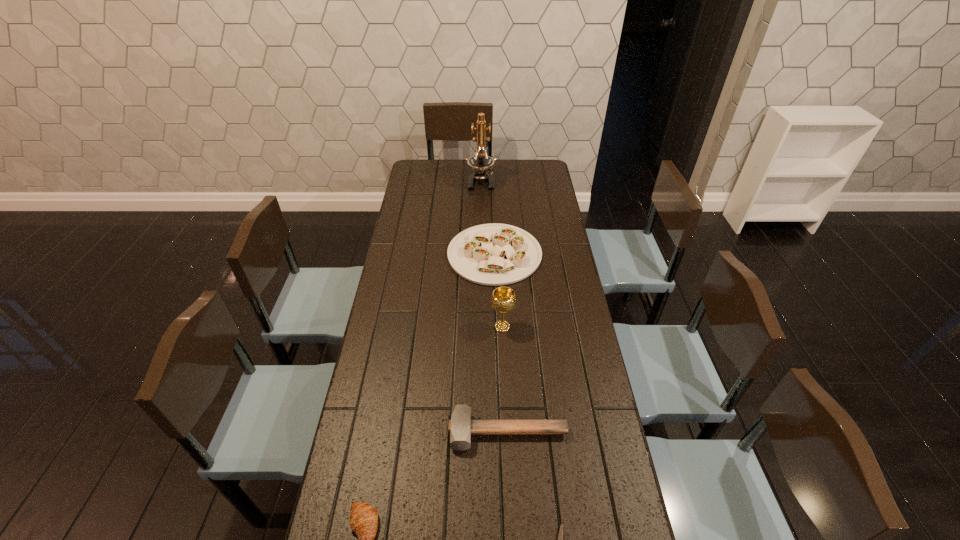
Where is `the farthest object`? the farthest object is located at coordinates (480, 162).

Where is `the tallest object`? This screenshot has height=540, width=960. the tallest object is located at coordinates (480, 162).

Where is `the third farthest object`? The image size is (960, 540). the third farthest object is located at coordinates (503, 299).

Identify the location of chalice. This screenshot has height=540, width=960. (503, 299).

Identify the location of platter. (494, 254).

Identify the location of mallet. Image resolution: width=960 pixels, height=540 pixels. (460, 427).

Find the location of a particular element. This screenshot has height=540, width=960. the fourth farthest object is located at coordinates (460, 427).

The height and width of the screenshot is (540, 960). What are the coordinates of `free space located 0.140m at the eyepiece of the microscope` in the screenshot? It's located at (481, 210).

This screenshot has height=540, width=960. I want to click on vacant region located 0.140m on the left of the chalice, so click(x=449, y=327).

In order to click on vacant space located on the back of the second farthest object in this screenshot , I will do `click(492, 212)`.